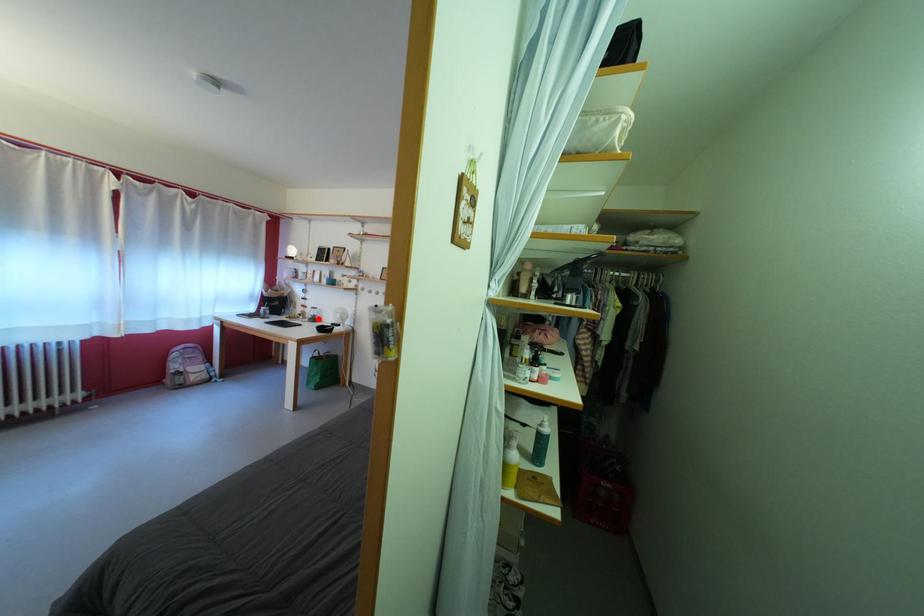
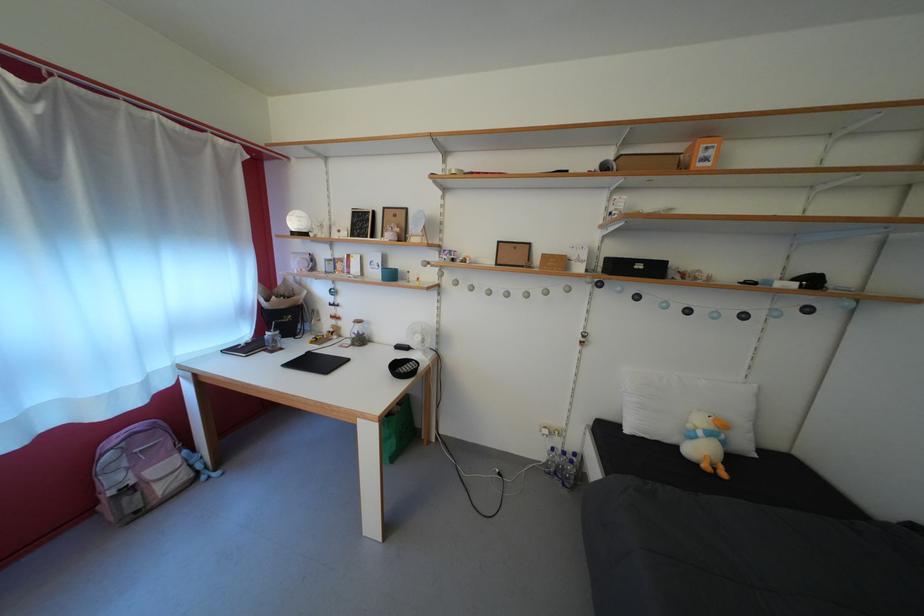
Locate, in the second image, the point that corresponds to the highlighted location in the first image.

(358, 334)